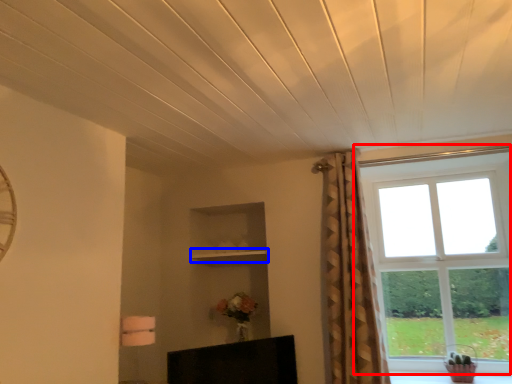
Question: Among these objects, which one is nearest to the camera, window (highlighted by a red box) or shelf (highlighted by a blue box)?

Choices:
 (A) window
 (B) shelf

Answer: (A)